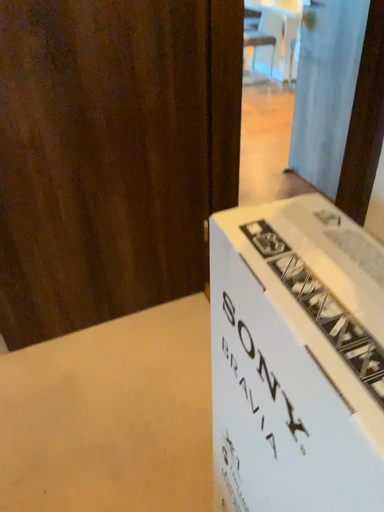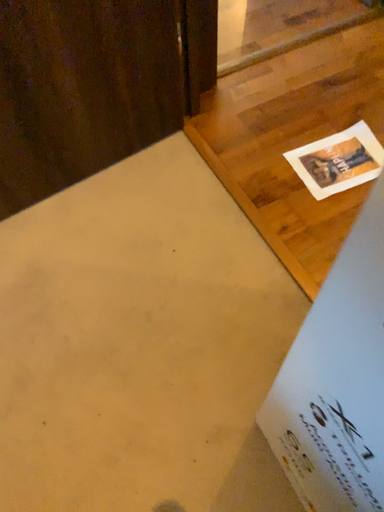
Question: How did the camera likely rotate when shooting the video?

Choices:
 (A) rotated right
 (B) rotated left

Answer: (A)